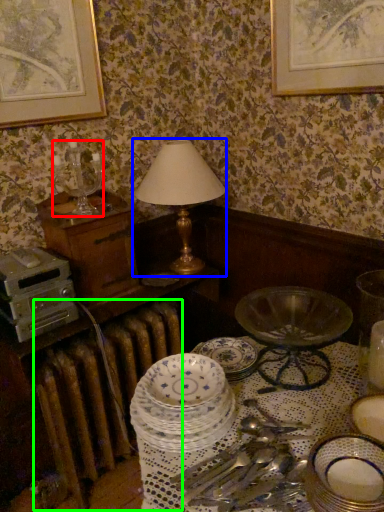
Question: Which object is the farthest from candle holder (highlighted by a red box)? Choose among these: table lamp (highlighted by a blue box) or radiator (highlighted by a green box).

Choices:
 (A) table lamp
 (B) radiator

Answer: (B)